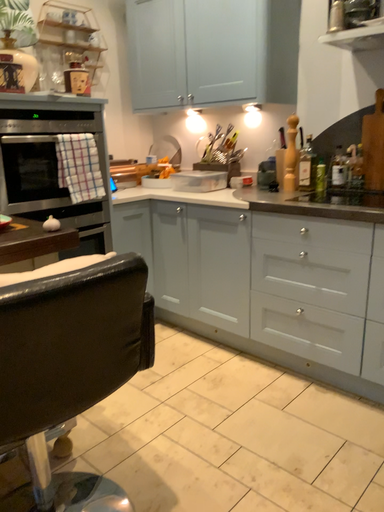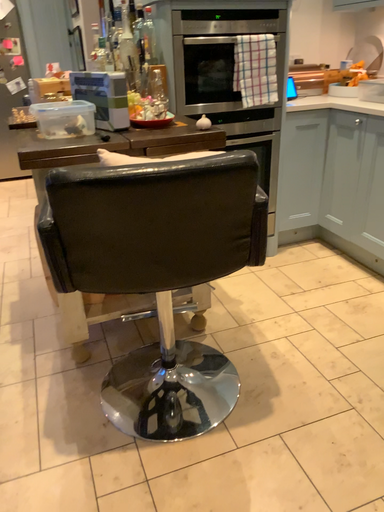
Question: Which way did the camera rotate in the video?

Choices:
 (A) rotated upward
 (B) rotated downward

Answer: (B)